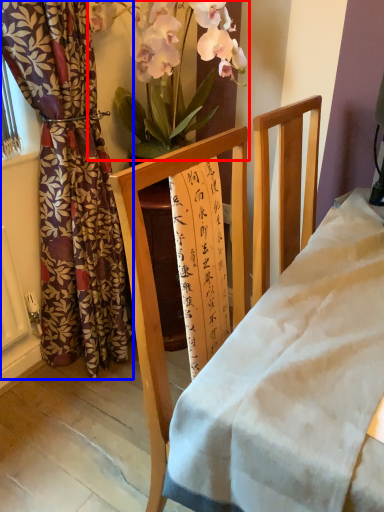
Question: Which point is closer to the camera, floral arrangement (highlighted by a red box) or curtain (highlighted by a blue box)?

Choices:
 (A) floral arrangement
 (B) curtain

Answer: (B)